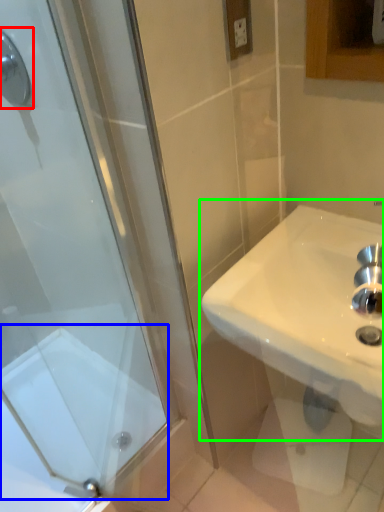
Question: Estimate the real-world distances between objects in this image. Which object is closer to shower (highlighted by a red box), bath (highlighted by a blue box) or sink (highlighted by a green box)?

Choices:
 (A) bath
 (B) sink

Answer: (B)